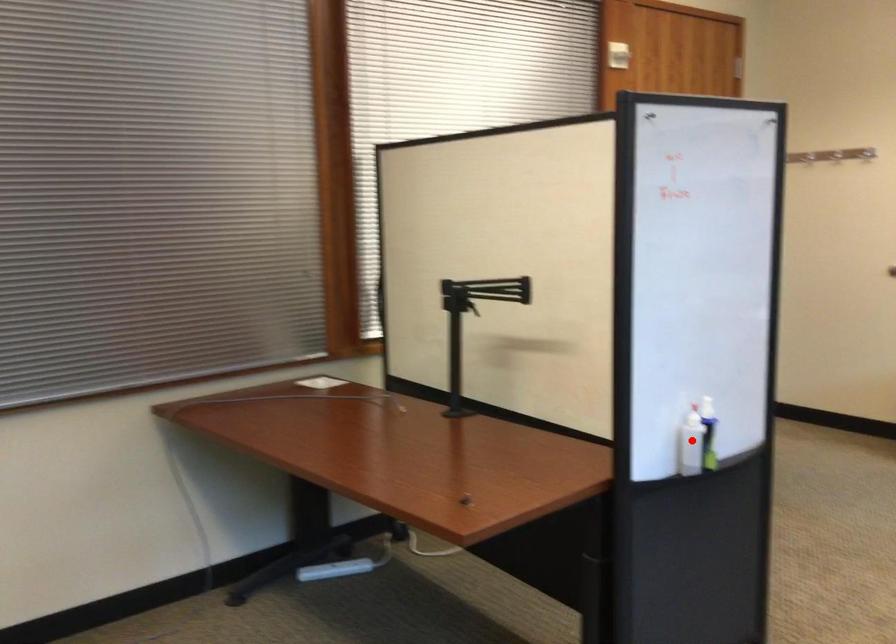
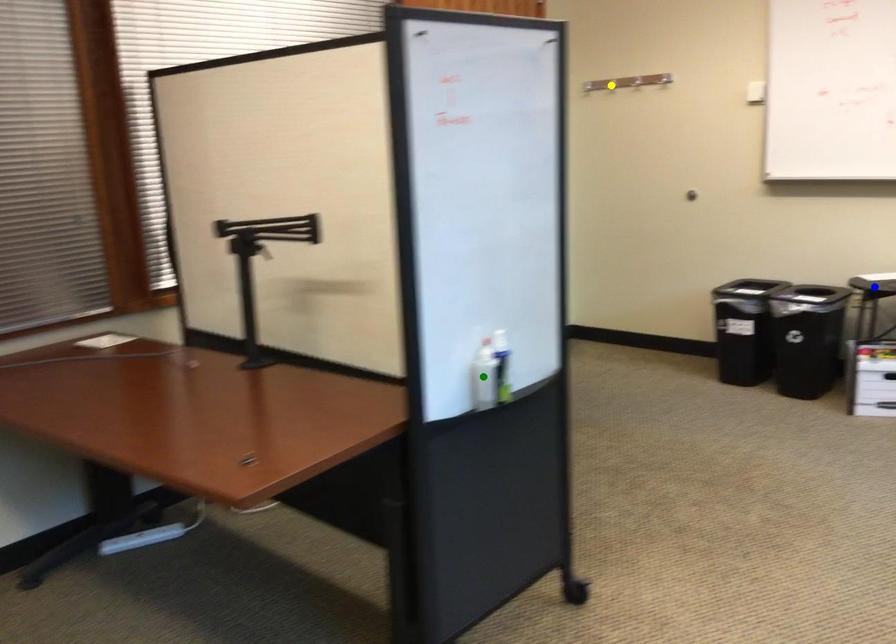
Question: I am providing you with two images of the same scene from different viewpoints. A red point is marked on the first image. You are given multiple points on the second image. Which mark in image 2 goes with the point in image 1?

Choices:
 (A) blue point
 (B) yellow point
 (C) green point

Answer: (C)